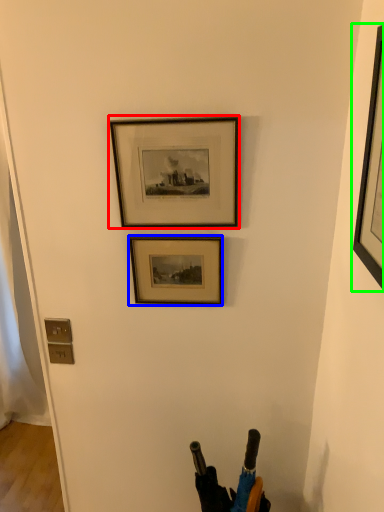
Question: Which is nearer to the picture frame (highlighted by a red box)? picture frame (highlighted by a blue box) or picture frame (highlighted by a green box).

Choices:
 (A) picture frame
 (B) picture frame

Answer: (A)